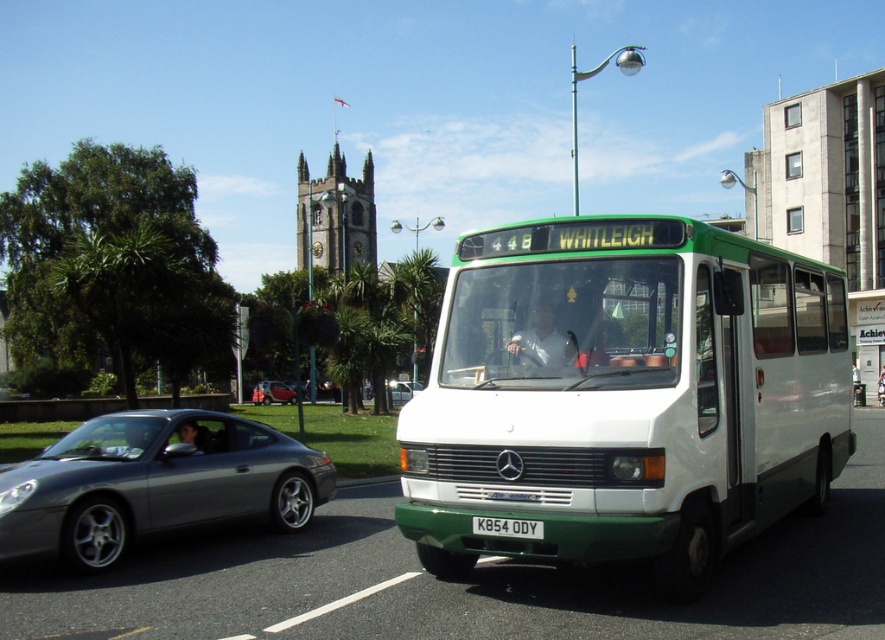
Question: Which object is closer to the camera taking this photo?

Choices:
 (A) white matte bus at center
 (B) metallic silver car at center
 (C) satin silver car at left
 (D) white plastic license plate at center

Answer: (A)

Question: Does green plastic bus stop at center appear on the left side of white plastic license plate at center?

Choices:
 (A) yes
 (B) no

Answer: (B)

Question: Does satin silver car at left appear on the left side of green plastic bus stop at center?

Choices:
 (A) yes
 (B) no

Answer: (A)

Question: Which point is farther to the camera?

Choices:
 (A) (879, 337)
 (B) (493, 522)

Answer: (A)

Question: Which point is closer to the camera?

Choices:
 (A) (177, 506)
 (B) (610, 419)
 (C) (856, 298)

Answer: (B)

Question: Can you confirm if white matte bus at center is positioned to the right of satin silver car at left?

Choices:
 (A) yes
 (B) no

Answer: (A)